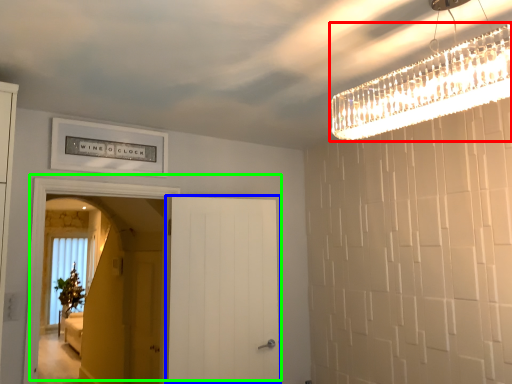
Question: Which object is the farthest from light fixture (highlighted by a red box)? Choose among these: door (highlighted by a blue box) or door (highlighted by a green box).

Choices:
 (A) door
 (B) door

Answer: (B)